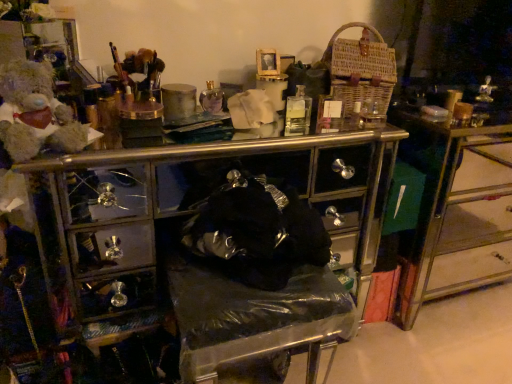
Question: Does woven brown basket at upper right have a larger size compared to metallic/golden drawer at right?

Choices:
 (A) no
 (B) yes

Answer: (A)

Question: Is metallic/golden drawer at right inside woven brown basket at upper right?

Choices:
 (A) yes
 (B) no

Answer: (B)

Question: Is woven brown basket at upper right to the right of metallic/golden drawer at right from the viewer's perspective?

Choices:
 (A) no
 (B) yes

Answer: (A)

Question: Is woven brown basket at upper right positioned far away from metallic/golden drawer at right?

Choices:
 (A) yes
 (B) no

Answer: (B)

Question: Does woven brown basket at upper right turn towards metallic/golden drawer at right?

Choices:
 (A) yes
 (B) no

Answer: (B)

Question: From a real-world perspective, is woven brown basket at upper right physically below metallic/golden drawer at right?

Choices:
 (A) yes
 (B) no

Answer: (B)

Question: Would you say woven brown basket at upper right contains fluffy beige teddy bear at left?

Choices:
 (A) yes
 (B) no

Answer: (B)

Question: From a real-world perspective, is woven brown basket at upper right located higher than fluffy beige teddy bear at left?

Choices:
 (A) no
 (B) yes

Answer: (B)

Question: From a real-world perspective, is woven brown basket at upper right below fluffy beige teddy bear at left?

Choices:
 (A) yes
 (B) no

Answer: (B)

Question: Is the depth of woven brown basket at upper right greater than that of fluffy beige teddy bear at left?

Choices:
 (A) no
 (B) yes

Answer: (B)

Question: From the image's perspective, is woven brown basket at upper right over fluffy beige teddy bear at left?

Choices:
 (A) yes
 (B) no

Answer: (A)

Question: Does woven brown basket at upper right appear on the left side of fluffy beige teddy bear at left?

Choices:
 (A) no
 (B) yes

Answer: (A)

Question: Is metallic/golden drawer at right positioned in front of fluffy beige teddy bear at left?

Choices:
 (A) no
 (B) yes

Answer: (A)